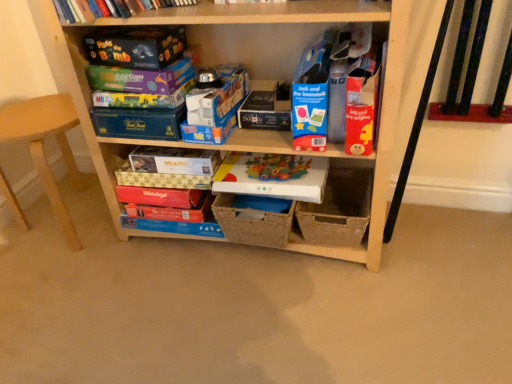
Measure the distance between bright red cardboard book at upper center, the 4th paperback book from the top, and camera.

bright red cardboard book at upper center, the 4th paperback book from the top, is 3.40 feet away from camera.

How much space does matte gold paperback book at center, arranged as the 5th paperback book when viewed from the top, occupy vertically?

matte gold paperback book at center, arranged as the 5th paperback book when viewed from the top, is 2.11 inches in height.

Locate an element on the screen. The width and height of the screenshot is (512, 384). matt black game box at upper left, placed as the seventh paperback book when sorted from bottom to top is located at coordinates (135, 46).

What do you see at coordinates (254, 219) in the screenshot? I see `natural woven basket at center, which is the 3th storage box in top-to-bottom order` at bounding box center [254, 219].

Image resolution: width=512 pixels, height=384 pixels. I want to click on bright red cardboard book at upper center, the 4th paperback book from the bottom, so click(x=310, y=107).

Are matte black storage box at center, the third storage box ordered from the bottom, and matte board game at upper left, the second paperback book from the top, making contact?

matte black storage box at center, the third storage box ordered from the bottom, is not next to matte board game at upper left, the second paperback book from the top, and they're not touching.

Looking at this image, is matte black storage box at center, the third storage box ordered from the bottom, oriented towards matte board game at upper left, the second paperback book from the top?

No.

Considering the sizes of objects matte black storage box at center, the third storage box ordered from the bottom, and matte board game at upper left, the second paperback book from the top, in the image provided, who is thinner, matte black storage box at center, the third storage box ordered from the bottom, or matte board game at upper left, the second paperback book from the top,?

matte board game at upper left, the second paperback book from the top.

Which object is closer to the camera taking this photo, matte black storage box at center, which is counted as the first storage box, starting from the top, or matte board game at upper left, the second paperback book from the top?

matte board game at upper left, the second paperback book from the top, is in front.

Can you confirm if matte gold paperback book at center, arranged as the 5th paperback book when viewed from the top, is smaller than wooden chair at left?

Yes, matte gold paperback book at center, arranged as the 5th paperback book when viewed from the top, is smaller than wooden chair at left.

From the image's perspective, which one is positioned higher, matte gold paperback book at center, the 3th paperback book in the bottom-to-top sequence, or wooden chair at left?

From the image's view, wooden chair at left is above.

Considering the positions of point (169, 148) and point (22, 132), is point (169, 148) closer or farther from the camera than point (22, 132)?

Clearly, point (169, 148) is more distant from the camera than point (22, 132).

Consider the image. From the image's perspective, which is above, matt black game box at upper left, positioned as the 1th paperback book in top-to-bottom order, or matte black storage box at center, the third storage box ordered from the bottom?

matt black game box at upper left, positioned as the 1th paperback book in top-to-bottom order, from the image's perspective.

You are a GUI agent. You are given a task and a screenshot of the screen. Output one action in this format:
    pyautogui.click(x=<x>, y=<y>)
    Task: Click on the storage box that is the 2nd one when counting backward from the matt black game box at upper left, positioned as the 1th paperback book in top-to-bottom order
    
    Given the screenshot: What is the action you would take?
    pyautogui.click(x=266, y=106)

Which is farther, [148,37] or [244,109]?

The point [244,109] is more distant.

Is matt black game box at upper left, positioned as the 1th paperback book in top-to-bottom order, positioned before matte black storage box at center, the third storage box ordered from the bottom?

Yes, matt black game box at upper left, positioned as the 1th paperback book in top-to-bottom order, is closer to the viewer.

Between red matte board game at lower center, the 7th paperback book viewed from the top, and natural woven basket at center, which is the 1th storage box from bottom to top, which one has less height?

With less height is red matte board game at lower center, the 7th paperback book viewed from the top.

Is red matte board game at lower center, the 7th paperback book viewed from the top, aimed at natural woven basket at center, which is the 3th storage box in top-to-bottom order?

No, red matte board game at lower center, the 7th paperback book viewed from the top, is not facing towards natural woven basket at center, which is the 3th storage box in top-to-bottom order.

Can you confirm if red matte board game at lower center, the 7th paperback book viewed from the top, is smaller than natural woven basket at center, which is the 1th storage box from bottom to top?

Correct, red matte board game at lower center, the 7th paperback book viewed from the top, occupies less space than natural woven basket at center, which is the 1th storage box from bottom to top.

Considering the sizes of objects wooden shelf at center and matte cardboard book at upper center in the image provided, who is wider, wooden shelf at center or matte cardboard book at upper center?

With larger width is wooden shelf at center.

Is wooden shelf at center next to matte cardboard book at upper center and touching it?

No, wooden shelf at center is not making contact with matte cardboard book at upper center.

Is wooden shelf at center closer to camera compared to matte cardboard book at upper center?

Yes, it is in front of matte cardboard book at upper center.

You are a GUI agent. You are given a task and a screenshot of the screen. Output one action in this format:
    pyautogui.click(x=<x>, y=<y>)
    Task: Click on the shelf below the matte cardboard book at upper center (from a real-world perspective)
    
    Given the screenshot: What is the action you would take?
    pyautogui.click(x=382, y=97)

Does bright red cardboard book at upper center, the 4th paperback book from the top, turn towards wooden chair at left?

No, bright red cardboard book at upper center, the 4th paperback book from the top, is not turned towards wooden chair at left.

From the image's perspective, is bright red cardboard book at upper center, the 4th paperback book from the top, under wooden chair at left?

No.

Would you say bright red cardboard book at upper center, the 4th paperback book from the top, contains wooden chair at left?

Actually, wooden chair at left is outside bright red cardboard book at upper center, the 4th paperback book from the top.

Which point is more forward, (302, 116) or (45, 128)?

The point (302, 116) is closer.

Image resolution: width=512 pixels, height=384 pixels. I want to click on the 2nd storage box to the right of the matte board game at upper left, the second paperback book from the top, counting from the anchor's position, so click(254, 219).

From a real-world perspective, who is located lower, natural woven basket at center, which is the 3th storage box in top-to-bottom order, or matte board game at upper left, the sixth paperback book from the bottom?

natural woven basket at center, which is the 3th storage box in top-to-bottom order, is physically lower.

From the picture: Is natural woven basket at center, which is the 1th storage box from bottom to top, inside or outside of matte board game at upper left, the sixth paperback book from the bottom?

natural woven basket at center, which is the 1th storage box from bottom to top, is outside matte board game at upper left, the sixth paperback book from the bottom.

From the picture: Can you confirm if natural woven basket at center, which is the 1th storage box from bottom to top, is smaller than matte board game at upper left, the sixth paperback book from the bottom?

Incorrect, natural woven basket at center, which is the 1th storage box from bottom to top, is not smaller in size than matte board game at upper left, the sixth paperback book from the bottom.

From the matte board game at upper left, the second paperback book from the top, count 3rd storage box to the right and point to it. Please provide its 2D coordinates.

[(266, 106)]

The image size is (512, 384). I want to click on paperback book that is the 1st one above the wooden chair at left (from a real-world perspective), so click(174, 160).

Estimate the real-world distances between objects in this image. Which object is closer to wooden chair at left, matte purple board game at center, the 5th paperback book in the bottom-to-top sequence, or matte black storage box at center, the third storage box ordered from the bottom?

matte purple board game at center, the 5th paperback book in the bottom-to-top sequence, is positioned closer to the anchor wooden chair at left.

From the image, which object appears to be farther from matte plastic board game at center, positioned as the sixth paperback book in top-to-bottom order, wooden chair at left or wooden shelf at center?

The object further to matte plastic board game at center, positioned as the sixth paperback book in top-to-bottom order, is wooden chair at left.

Which object lies further to the anchor point white cardboard box at lower center, matte purple board game at center, the 5th paperback book in the bottom-to-top sequence, or red matte board game at lower center, the 7th paperback book viewed from the top?

matte purple board game at center, the 5th paperback book in the bottom-to-top sequence.

Estimate the real-world distances between objects in this image. Which object is closer to white cardboard box at lower center, matt black game box at upper left, positioned as the 1th paperback book in top-to-bottom order, or wooden chair at left?

The object closer to white cardboard box at lower center is matt black game box at upper left, positioned as the 1th paperback book in top-to-bottom order.

Estimate the real-world distances between objects in this image. Which object is closer to white cardboard box at lower center, matte gold paperback book at center, arranged as the 5th paperback book when viewed from the top, or matte plastic board game at center, positioned as the sixth paperback book in top-to-bottom order?

matte plastic board game at center, positioned as the sixth paperback book in top-to-bottom order.

Considering their positions, is matte purple board game at center, acting as the third paperback book starting from the top, positioned further to matt black game box at upper left, positioned as the 1th paperback book in top-to-bottom order, than matte cardboard book at upper center?

Based on the image, matte cardboard book at upper center appears to be further to matt black game box at upper left, positioned as the 1th paperback book in top-to-bottom order.

Based on their spatial positions, is matte black storage box at center, which is counted as the first storage box, starting from the top, or white cardboard box at lower center closer to bright red cardboard book at upper center, the 4th paperback book from the bottom?

Based on the image, matte black storage box at center, which is counted as the first storage box, starting from the top, appears to be nearer to bright red cardboard book at upper center, the 4th paperback book from the bottom.

Estimate the real-world distances between objects in this image. Which object is closer to wooden chair at left, blue cardboard box at center, which is the 2th storage box in bottom-to-top order, or bright red cardboard book at upper center, the 4th paperback book from the top?

blue cardboard box at center, which is the 2th storage box in bottom-to-top order, lies closer to wooden chair at left than the other object.

In order to click on storage box between wooden chair at left and matte cardboard book at upper center in this screenshot , I will do `click(139, 122)`.

The image size is (512, 384). Identify the location of storage box positioned between wooden shelf at center and matte black storage box at center, the third storage box ordered from the bottom, from near to far. (139, 122).

The width and height of the screenshot is (512, 384). Find the location of `book between matte purple board game at center, acting as the third paperback book starting from the top, and matte black storage box at center, the third storage box ordered from the bottom, in the horizontal direction`. book between matte purple board game at center, acting as the third paperback book starting from the top, and matte black storage box at center, the third storage box ordered from the bottom, in the horizontal direction is located at coordinates (247, 1).

What are the coordinates of `shelf between matte cardboard book at upper center and matte gold paperback book at center, arranged as the 5th paperback book when viewed from the top, vertically` in the screenshot? It's located at (382, 97).